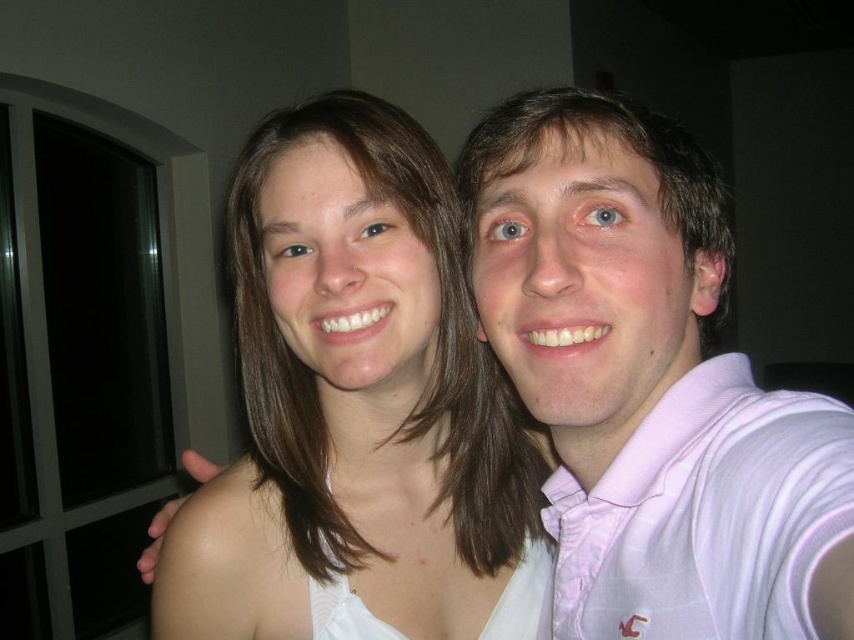
You are trying to decide which pink polo shirt to wear for a casual evening out. You see both the pink striped polo shirt at upper right and the pink cotton polo shirt at right in the image. Which one is bigger?

The pink striped polo shirt at upper right is larger in size compared to the pink cotton polo shirt at right, so you should choose the pink striped polo shirt at upper right if you prefer a bigger size.

You are trying to decide which item to take for a photoshoot. The scene has a white fabric at center and a pink cotton polo shirt at right. Based on their sizes, which one could potentially cover a larger area when used as a backdrop?

The white fabric at center might be wider than the pink cotton polo shirt at right, so the white fabric at center could potentially cover a larger area when used as a backdrop.

You are taking a selfie with two friends. You notice two points in the image at coordinates point (x=493, y=616) and point (x=566, y=97). Which point is closer to you?

Point (x=493, y=616) is further to the viewer than point (x=566, y=97), so the closer point to you is point (x=493, y=616).